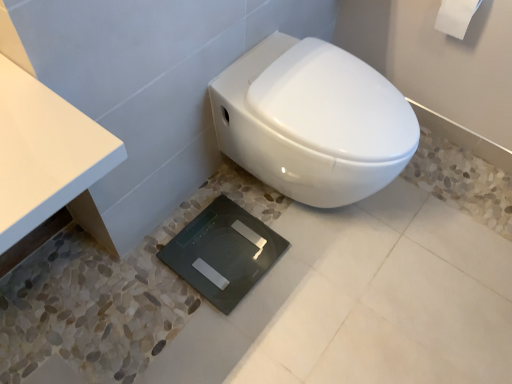
I want to click on unoccupied area behind black glass scale at center, so click(234, 196).